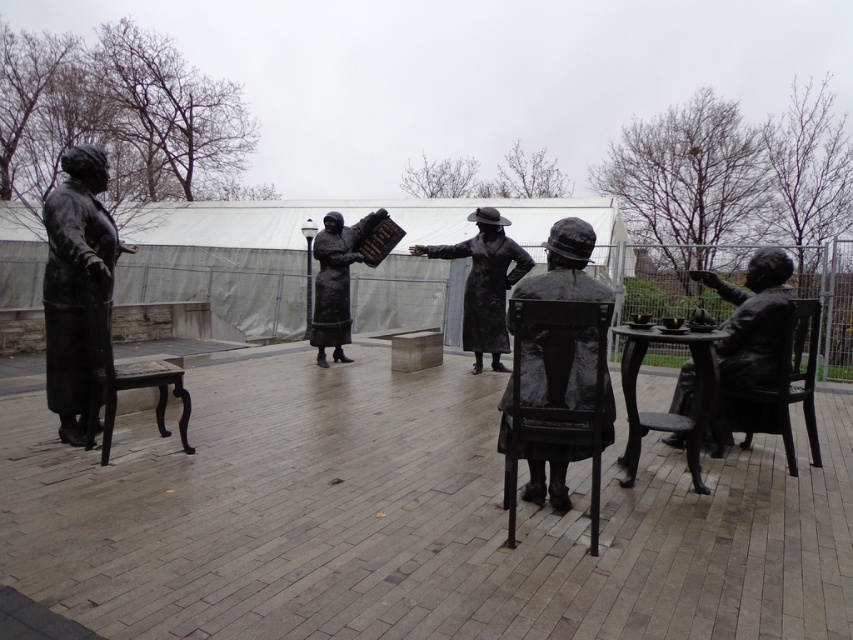
The height and width of the screenshot is (640, 853). What do you see at coordinates (666, 412) in the screenshot?
I see `black polished wood table at center` at bounding box center [666, 412].

Can you confirm if black polished wood table at center is thinner than bronze statue of woman holding book at center?

No.

What do you see at coordinates (666, 412) in the screenshot?
I see `black polished wood table at center` at bounding box center [666, 412].

At what (x,y) coordinates should I click in order to perform the action: click on black polished wood table at center. Please return your answer as a coordinate pair (x, y). Image resolution: width=853 pixels, height=640 pixels. Looking at the image, I should click on (666, 412).

Is point (734, 349) positioned after point (506, 349)?

No, (734, 349) is in front of (506, 349).

Can you confirm if bronze statue at right is bigger than shiny black coat at center?

Incorrect, bronze statue at right is not larger than shiny black coat at center.

Does point (724, 321) come behind point (474, 298)?

No.

I want to click on bronze statue at right, so click(753, 321).

Is shiny black coat at center wider than black wooden chair at right?

Correct, the width of shiny black coat at center exceeds that of black wooden chair at right.

Between point (474, 291) and point (795, 387), which one is positioned behind?

The point (474, 291) is more distant.

What are the coordinates of `shiny black coat at center` in the screenshot? It's located at (485, 282).